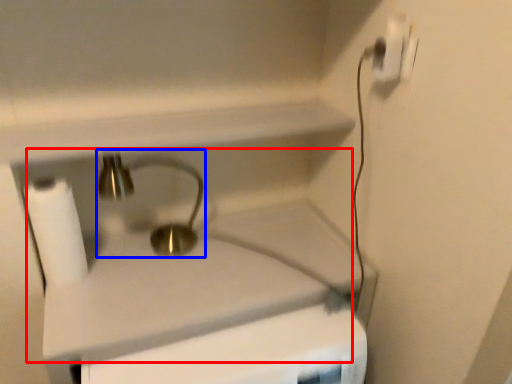
Question: Among these objects, which one is farthest to the camera, sink (highlighted by a red box) or faucet (highlighted by a blue box)?

Choices:
 (A) sink
 (B) faucet

Answer: (B)